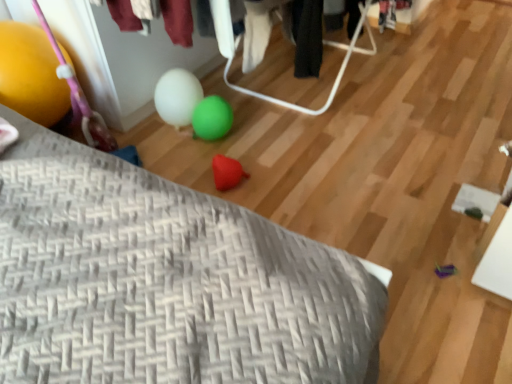
Question: Is yellow rubber balloon at left bigger than gray woven pillow at lower left?

Choices:
 (A) yes
 (B) no

Answer: (B)

Question: From a real-world perspective, is yellow rubber balloon at left located beneath gray woven pillow at lower left?

Choices:
 (A) no
 (B) yes

Answer: (A)

Question: Is yellow rubber balloon at left closer to the viewer compared to gray woven pillow at lower left?

Choices:
 (A) yes
 (B) no

Answer: (B)

Question: From the image's perspective, would you say yellow rubber balloon at left is shown under gray woven pillow at lower left?

Choices:
 (A) no
 (B) yes

Answer: (B)

Question: Does yellow rubber balloon at left have a smaller size compared to gray woven pillow at lower left?

Choices:
 (A) no
 (B) yes

Answer: (B)

Question: From a real-world perspective, is yellow rubber balloon at left physically located above or below gray woven pillow at lower left?

Choices:
 (A) above
 (B) below

Answer: (A)

Question: Considering the positions of yellow rubber balloon at left and gray woven pillow at lower left in the image, is yellow rubber balloon at left bigger or smaller than gray woven pillow at lower left?

Choices:
 (A) small
 (B) big

Answer: (A)

Question: Would you say yellow rubber balloon at left is inside or outside gray woven pillow at lower left?

Choices:
 (A) outside
 (B) inside

Answer: (A)

Question: Based on their positions, is yellow rubber balloon at left located to the left or right of gray woven pillow at lower left?

Choices:
 (A) right
 (B) left

Answer: (B)

Question: In terms of size, does rubber heart at center appear bigger or smaller than yellow rubber balloon at left?

Choices:
 (A) big
 (B) small

Answer: (B)

Question: Visually, is rubber heart at center positioned to the left or to the right of yellow rubber balloon at left?

Choices:
 (A) right
 (B) left

Answer: (A)

Question: From their relative heights in the image, would you say rubber heart at center is taller or shorter than yellow rubber balloon at left?

Choices:
 (A) short
 (B) tall

Answer: (A)

Question: In the image, is rubber heart at center positioned in front of or behind yellow rubber balloon at left?

Choices:
 (A) behind
 (B) front

Answer: (A)

Question: From the image's perspective, is gray woven pillow at lower left positioned above or below yellow rubber balloon at left?

Choices:
 (A) above
 (B) below

Answer: (A)

Question: From a real-world perspective, is gray woven pillow at lower left physically located above or below yellow rubber balloon at left?

Choices:
 (A) below
 (B) above

Answer: (A)